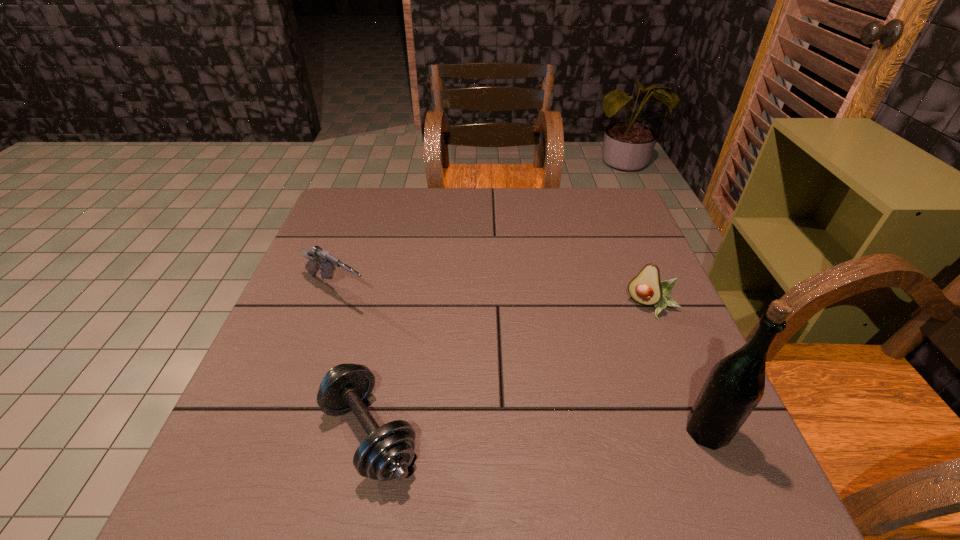
The height and width of the screenshot is (540, 960). What are the coordinates of `vacant space that's between the gun and the dumbbell` in the screenshot? It's located at (353, 362).

Where is `vacant space that's between the avocado and the gun`? The height and width of the screenshot is (540, 960). vacant space that's between the avocado and the gun is located at coordinates (494, 299).

This screenshot has height=540, width=960. Identify the location of free space between the avocado and the dumbbell. (511, 370).

Locate an element on the screen. free space between the gun and the avocado is located at coordinates (494, 299).

The image size is (960, 540). I want to click on object that is the second closest to the gun, so click(x=646, y=288).

This screenshot has width=960, height=540. In order to click on the second closest object to the gun in this screenshot , I will do `click(646, 288)`.

You are a GUI agent. You are given a task and a screenshot of the screen. Output one action in this format:
    pyautogui.click(x=<x>, y=<y>)
    Task: Click on the vacant space that satisfies the following two spatial constraints: 1. on the back side of the dumbbell; 2. on the left side of the avocado
    The image size is (960, 540).
    Given the screenshot: What is the action you would take?
    pyautogui.click(x=396, y=307)

Find the location of `free space in the image that satisfies the following two spatial constraints: 1. on the front side of the dumbbell; 2. on the left side of the gun`. free space in the image that satisfies the following two spatial constraints: 1. on the front side of the dumbbell; 2. on the left side of the gun is located at coordinates (285, 434).